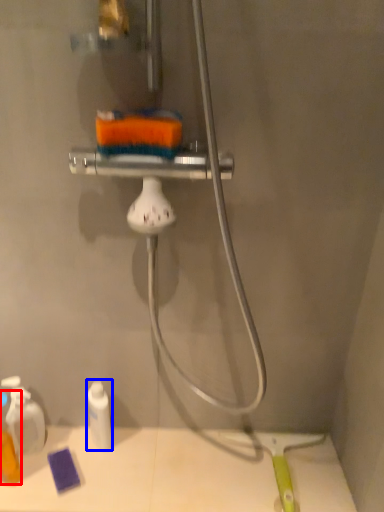
Question: Which point is further to the camera, toiletry (highlighted by a red box) or toiletry (highlighted by a blue box)?

Choices:
 (A) toiletry
 (B) toiletry

Answer: (B)